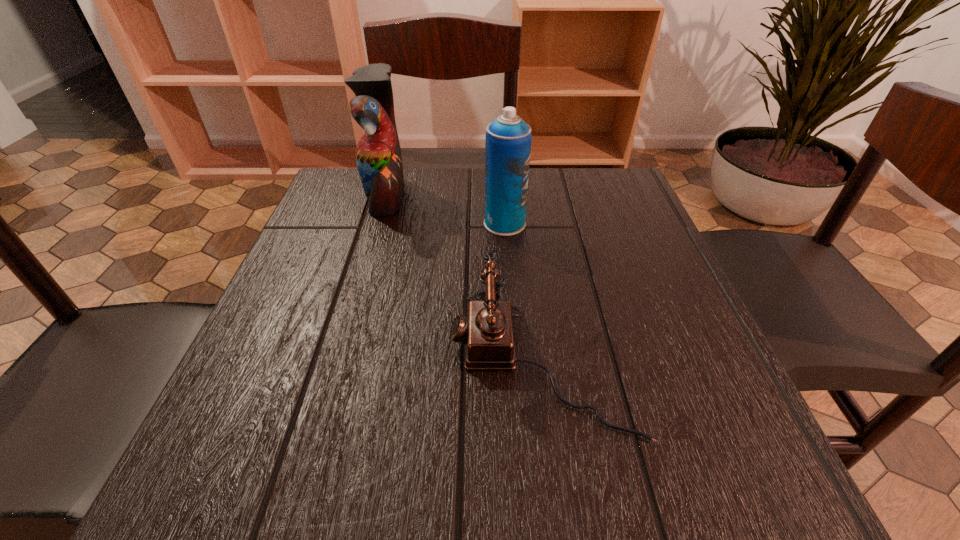
Where is `free space that satisfies the following two spatial constraints: 1. at the face of the leftmost object; 2. on the back side of the aerosol can`? The height and width of the screenshot is (540, 960). free space that satisfies the following two spatial constraints: 1. at the face of the leftmost object; 2. on the back side of the aerosol can is located at coordinates (378, 224).

Locate an element on the screen. This screenshot has width=960, height=540. free spot that satisfies the following two spatial constraints: 1. at the face of the aerosol can; 2. on the left side of the leftmost object is located at coordinates (378, 224).